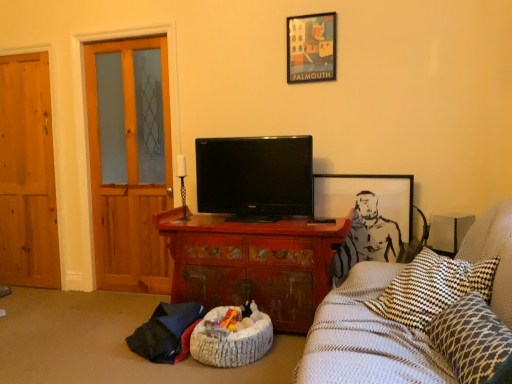
Question: Are gray paper picture frame at upper right, the second picture frame when ordered from top to bottom, and leopard print cushion at lower right making contact?

Choices:
 (A) yes
 (B) no

Answer: (B)

Question: Does gray paper picture frame at upper right, which is the first picture frame from bottom to top, have a lesser width compared to leopard print cushion at lower right?

Choices:
 (A) yes
 (B) no

Answer: (A)

Question: From the image's perspective, would you say gray paper picture frame at upper right, which is the first picture frame from bottom to top, is positioned over leopard print cushion at lower right?

Choices:
 (A) no
 (B) yes

Answer: (B)

Question: Is gray paper picture frame at upper right, the second picture frame when ordered from top to bottom, shorter than leopard print cushion at lower right?

Choices:
 (A) no
 (B) yes

Answer: (A)

Question: Is gray paper picture frame at upper right, the second picture frame when ordered from top to bottom, further to camera compared to leopard print cushion at lower right?

Choices:
 (A) no
 (B) yes

Answer: (B)

Question: Looking at the image, does wooden door at left, acting as the 1th door starting from the right, seem bigger or smaller compared to gray paper picture frame at upper right, which is the first picture frame from bottom to top?

Choices:
 (A) big
 (B) small

Answer: (A)

Question: In terms of height, does wooden door at left, acting as the 1th door starting from the right, look taller or shorter compared to gray paper picture frame at upper right, the second picture frame when ordered from top to bottom?

Choices:
 (A) short
 (B) tall

Answer: (B)

Question: Considering the positions of point (130, 107) and point (409, 236), is point (130, 107) closer or farther from the camera than point (409, 236)?

Choices:
 (A) closer
 (B) farther

Answer: (B)

Question: In terms of width, does wooden door at left, acting as the 1th door starting from the right, look wider or thinner when compared to gray paper picture frame at upper right, the second picture frame when ordered from top to bottom?

Choices:
 (A) wide
 (B) thin

Answer: (A)

Question: Is leopard print cushion at lower right in front of or behind white textured blanket at right in the image?

Choices:
 (A) front
 (B) behind

Answer: (A)

Question: Is leopard print cushion at lower right wider or thinner than white textured blanket at right?

Choices:
 (A) wide
 (B) thin

Answer: (B)

Question: Based on their sizes in the image, would you say leopard print cushion at lower right is bigger or smaller than white textured blanket at right?

Choices:
 (A) big
 (B) small

Answer: (B)

Question: Is leopard print cushion at lower right taller or shorter than white textured blanket at right?

Choices:
 (A) tall
 (B) short

Answer: (B)

Question: Is point (140, 153) positioned closer to the camera than point (380, 375)?

Choices:
 (A) farther
 (B) closer

Answer: (A)

Question: Is wooden door at left, acting as the 1th door starting from the right, in front of or behind white textured blanket at right in the image?

Choices:
 (A) behind
 (B) front

Answer: (A)